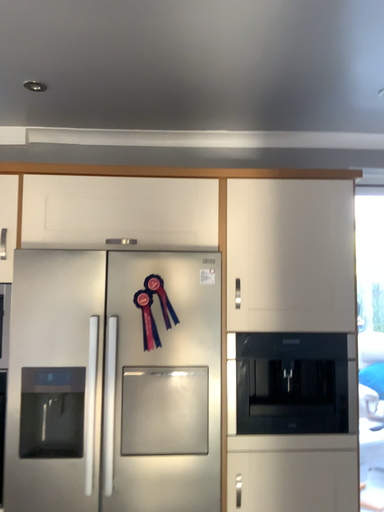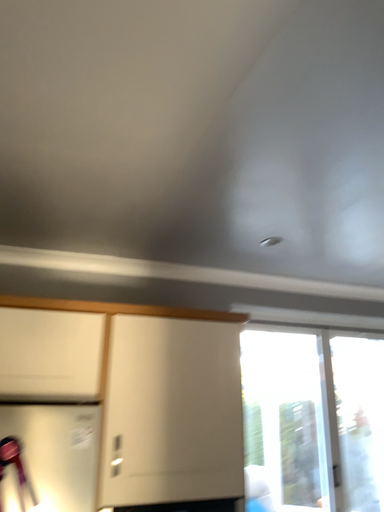
Question: How did the camera likely rotate when shooting the video?

Choices:
 (A) rotated downward
 (B) rotated upward

Answer: (B)